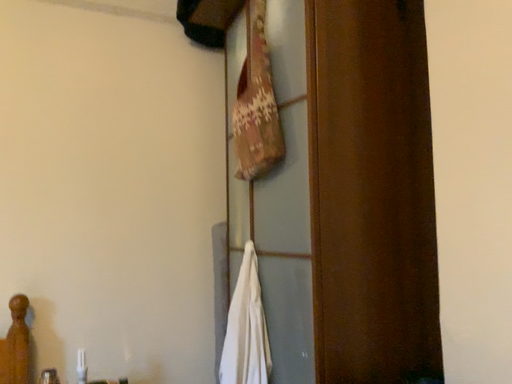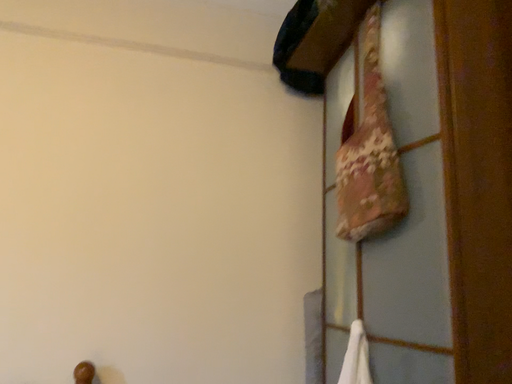
Question: How did the camera likely rotate when shooting the video?

Choices:
 (A) rotated upward
 (B) rotated downward

Answer: (A)